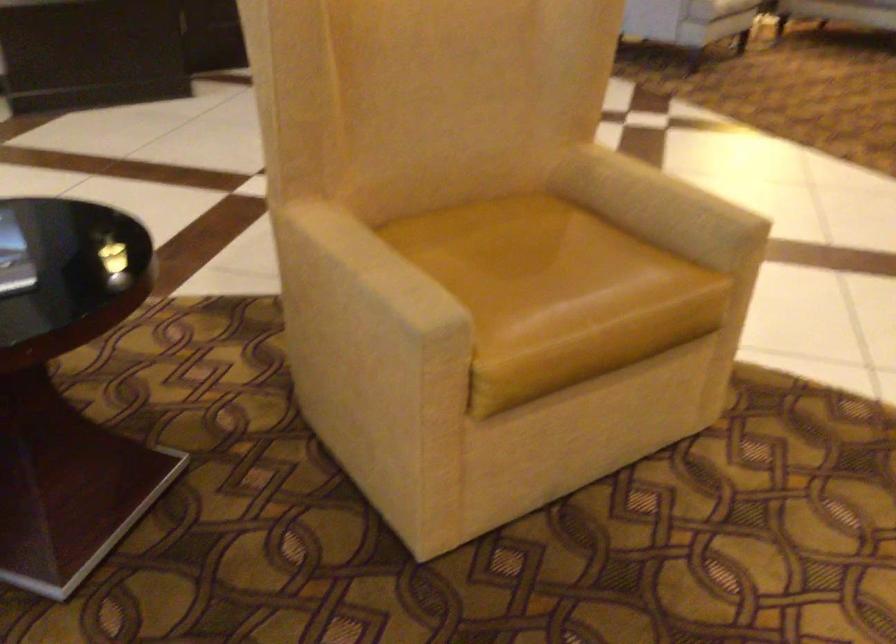
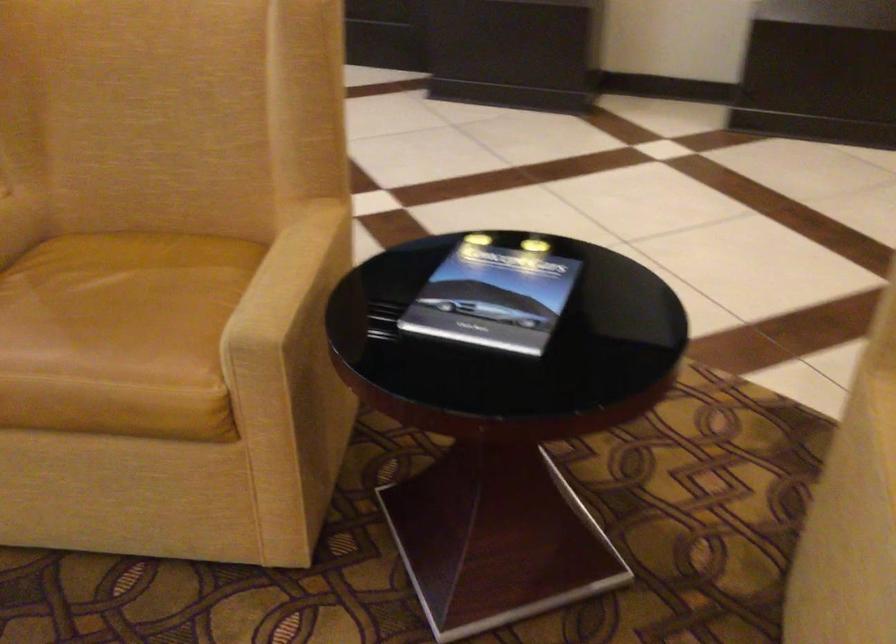
Question: The camera is either moving clockwise (left) or counter-clockwise (right) around the object. The first image is from the beginning of the video and the second image is from the end. Is the camera moving left or right when shooting the video?

Choices:
 (A) Left
 (B) Right

Answer: (B)